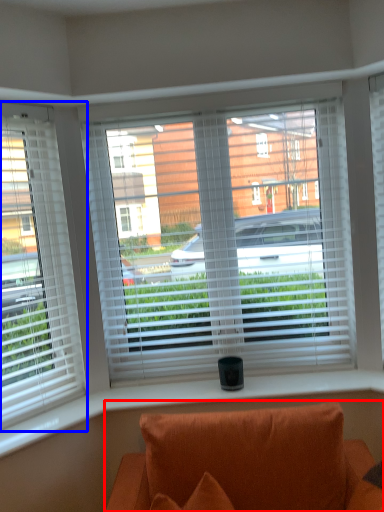
Question: Which point is closer to the camera, studio couch (highlighted by a red box) or window (highlighted by a blue box)?

Choices:
 (A) studio couch
 (B) window

Answer: (A)